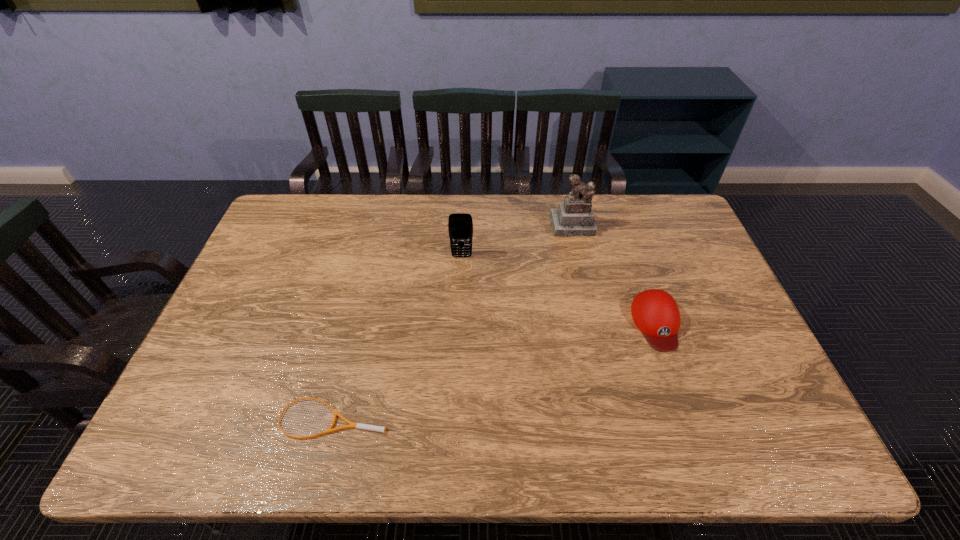
In order to click on the tallest object in this screenshot , I will do `click(574, 217)`.

Find the location of `the farthest object`. the farthest object is located at coordinates (574, 217).

The image size is (960, 540). Identify the location of the third object from right to left. (460, 225).

Where is `cellular telephone`? This screenshot has height=540, width=960. cellular telephone is located at coordinates pos(460,225).

Image resolution: width=960 pixels, height=540 pixels. Find the location of `the third farthest object`. the third farthest object is located at coordinates (656, 314).

This screenshot has width=960, height=540. What are the coordinates of `the third tallest object` in the screenshot? It's located at (656, 314).

You are a GUI agent. You are given a task and a screenshot of the screen. Output one action in this format:
    pyautogui.click(x=<x>, y=<y>)
    Task: Click on the leftmost object
    This screenshot has width=960, height=540.
    Given the screenshot: What is the action you would take?
    pyautogui.click(x=356, y=425)

The height and width of the screenshot is (540, 960). Find the location of `tennis racket`. tennis racket is located at coordinates [356, 425].

Find the location of a particular element. The image size is (960, 540). free space located 0.290m on the front-facing side of the farthest object is located at coordinates (590, 302).

What are the coordinates of `vacant space located on the screen of the third shortest object` in the screenshot? It's located at (461, 280).